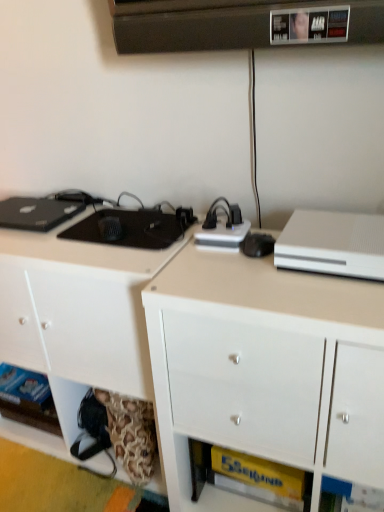
Locate an element on the screen. The width and height of the screenshot is (384, 512). free spot above white matte cabinet at lower left, which ranks as the first cabinetry in left-to-right order (from a real-world perspective) is located at coordinates (92, 237).